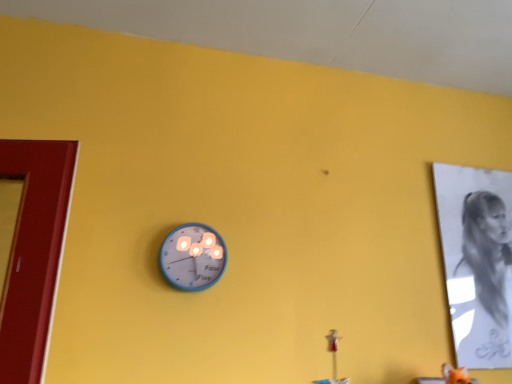
Question: In the image, is blue metallic wall clock at center positioned in front of or behind charcoal sketch of person at right?

Choices:
 (A) behind
 (B) front

Answer: (B)

Question: Considering the positions of blue metallic wall clock at center and charcoal sketch of person at right in the image, is blue metallic wall clock at center wider or thinner than charcoal sketch of person at right?

Choices:
 (A) thin
 (B) wide

Answer: (B)

Question: From the image's perspective, relative to charcoal sketch of person at right, is blue metallic wall clock at center above or below?

Choices:
 (A) above
 (B) below

Answer: (A)

Question: In terms of width, does charcoal sketch of person at right look wider or thinner when compared to blue metallic wall clock at center?

Choices:
 (A) thin
 (B) wide

Answer: (A)

Question: From a real-world perspective, is charcoal sketch of person at right positioned above or below blue metallic wall clock at center?

Choices:
 (A) above
 (B) below

Answer: (A)

Question: From the image's perspective, relative to blue metallic wall clock at center, is charcoal sketch of person at right above or below?

Choices:
 (A) below
 (B) above

Answer: (A)

Question: Considering their positions, is charcoal sketch of person at right located in front of or behind blue metallic wall clock at center?

Choices:
 (A) front
 (B) behind

Answer: (B)